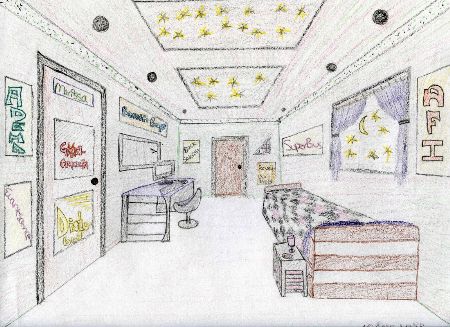
You are a GUI agent. You are given a task and a screenshot of the screen. Output one action in this format:
    pyautogui.click(x=<x>, y=<y>)
    Task: Click on the desk
    The height and width of the screenshot is (327, 450).
    Given the screenshot: What is the action you would take?
    pyautogui.click(x=145, y=194)